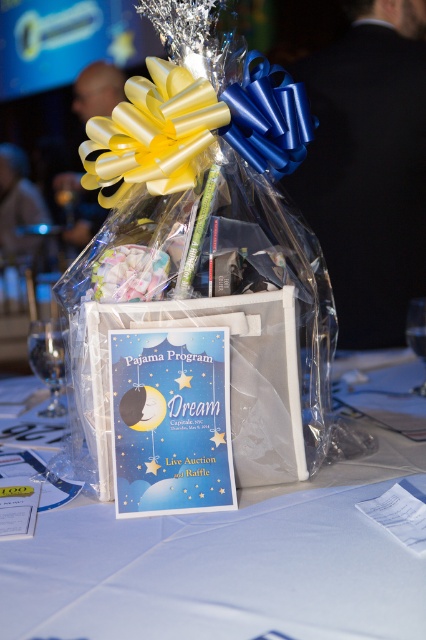
Is blue satin ribbon at upper center closer to the viewer compared to transparent glass at lower left?

Yes, it is in front of transparent glass at lower left.

Between point (273, 156) and point (37, 336), which one is positioned in front?

Positioned in front is point (273, 156).

Measure the distance between blue satin ribbon at upper center and camera.

blue satin ribbon at upper center is 20.07 inches away from camera.

In order to click on blue satin ribbon at upper center in this screenshot , I will do `click(267, 118)`.

Does blue paperboard at center appear over blue satin ribbon at upper center?

Incorrect, blue paperboard at center is not positioned above blue satin ribbon at upper center.

Is blue paperboard at center further to camera compared to blue satin ribbon at upper center?

No.

The image size is (426, 640). What do you see at coordinates (224, 566) in the screenshot?
I see `blue paperboard at center` at bounding box center [224, 566].

At what (x,y) coordinates should I click in order to perform the action: click on blue paperboard at center. Please return your answer as a coordinate pair (x, y). Looking at the image, I should click on (224, 566).

Who is lower down, yellow satin ribbon at center or blue satin ribbon at upper center?

yellow satin ribbon at center is lower down.

Can you confirm if yellow satin ribbon at center is bigger than blue satin ribbon at upper center?

Yes, yellow satin ribbon at center is bigger than blue satin ribbon at upper center.

Image resolution: width=426 pixels, height=640 pixels. In order to click on yellow satin ribbon at center in this screenshot , I will do `click(152, 132)`.